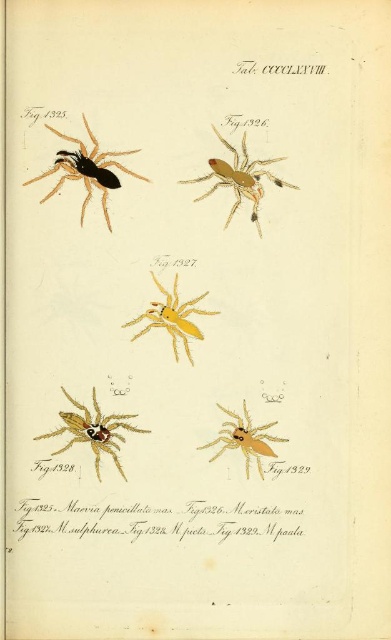
You are an entomologist examining the scientific illustration. You need to locate the matte black spider at upper left. What are its coordinates on the page?

The matte black spider at upper left is located at coordinates (87, 170).

What are the coordinates of the yellow matte spider at center?

The yellow matte spider at center is located at coordinates point (172,317).